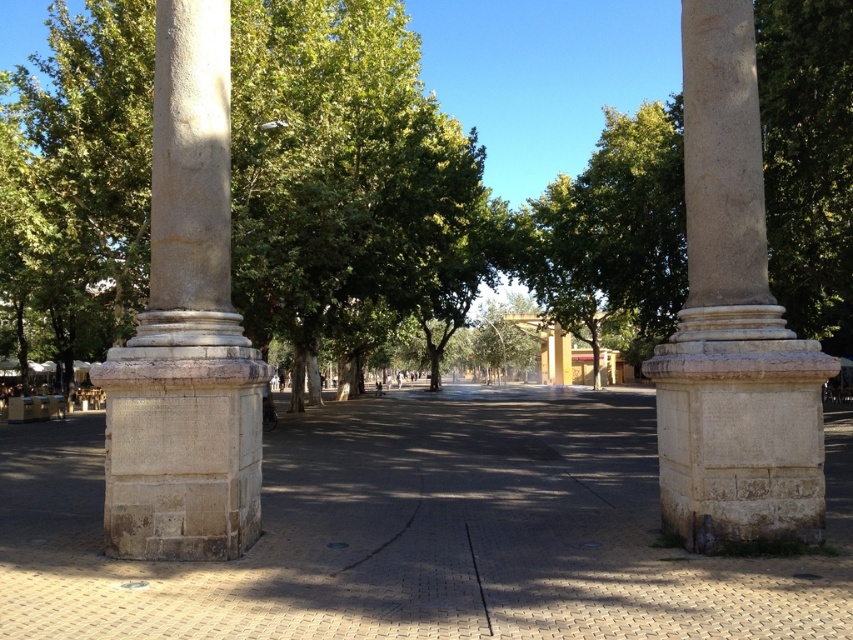
You are a visitor standing in the plaza and want to take a photo of the green leafy tree at center and the beige stone column at right. Which object should you focus on first if you want to capture both in a single frame without moving your camera?

The green leafy tree at center is located above the beige stone column at right, so you should focus on the beige stone column at right first to ensure both are in frame.

You are an architect designing a new plaza and want to incorporate two contrasting lines in the center. The black glossy line at center is taller than the black matte line at center. Which line would cast a longer shadow during midday when the sun is directly overhead?

The black glossy line at center would cast a longer shadow because it is taller than the black matte line at center, and taller objects generally cast longer shadows when the sun is overhead.

You are an architect designing a new plaza and want to incorporate two contrasting black lines at the center. The scene shows a black glossy line at center and a black matte line at center. Which line is more prominent visually?

The black glossy line at center is more prominent visually because it has a larger size compared to the black matte line at center.